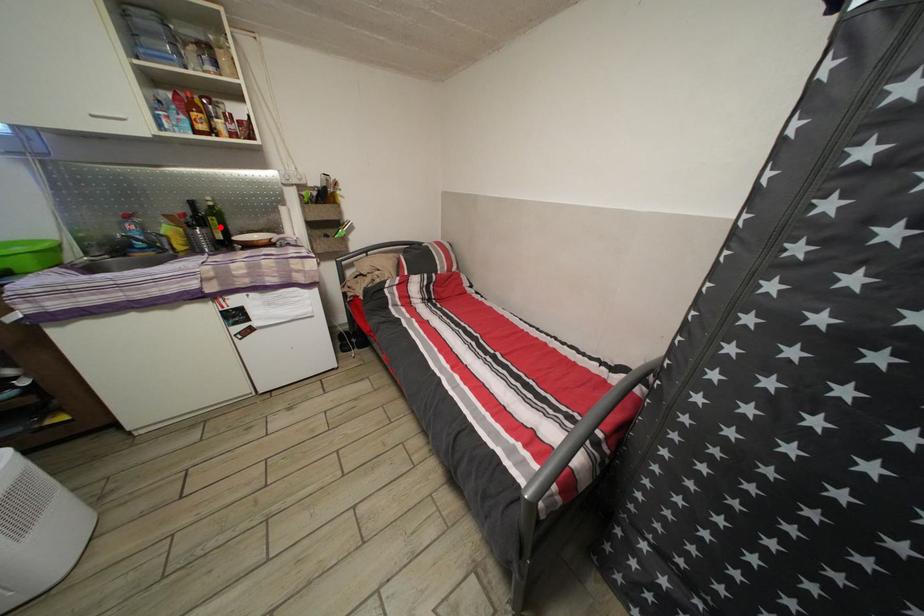
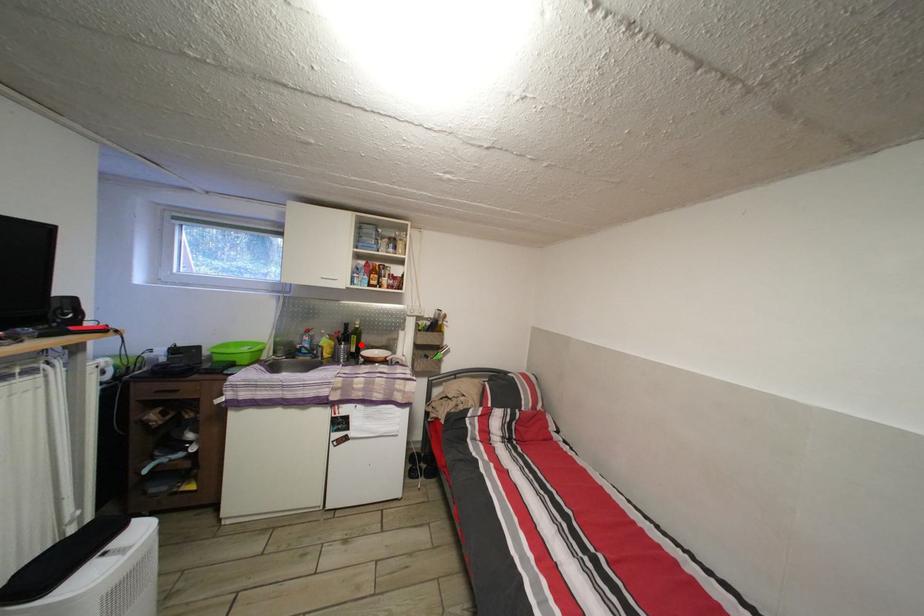
I am providing you with two images of the same scene from different viewpoints. A red point is marked on the first image and another point is marked on the second image. Do the highlighted points in image1 and image2 indicate the same real-world spot?

Yes